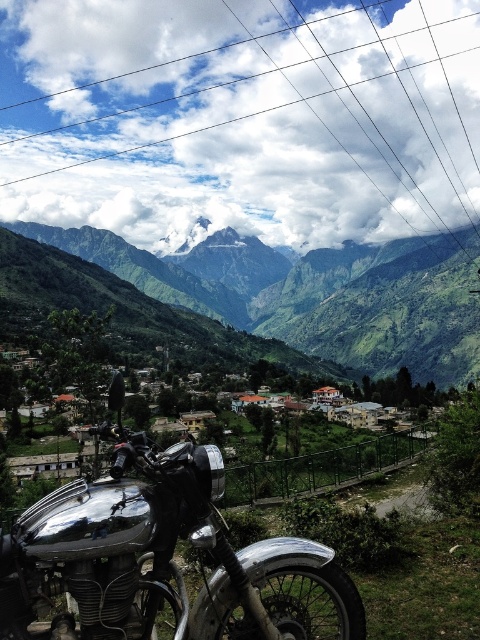
You are a hiker planning to cross the valley from the metallic wire at upper center to the motorcycle in the foreground. The valley has a steep slope. What is the minimum distance you need to descend to reach the motorcycle?

The minimum distance you need to descend is 663.98 meters.

You are a photographer planning to capture the polished chrome motorcycle at center and the metallic wire at upper center in a single frame. Based on the scene, can you determine if the motorcycle will be partially obscured by the wire?

The polished chrome motorcycle at center is behind the metallic wire at upper center, so yes, the motorcycle will be partially obscured by the wire in the frame.